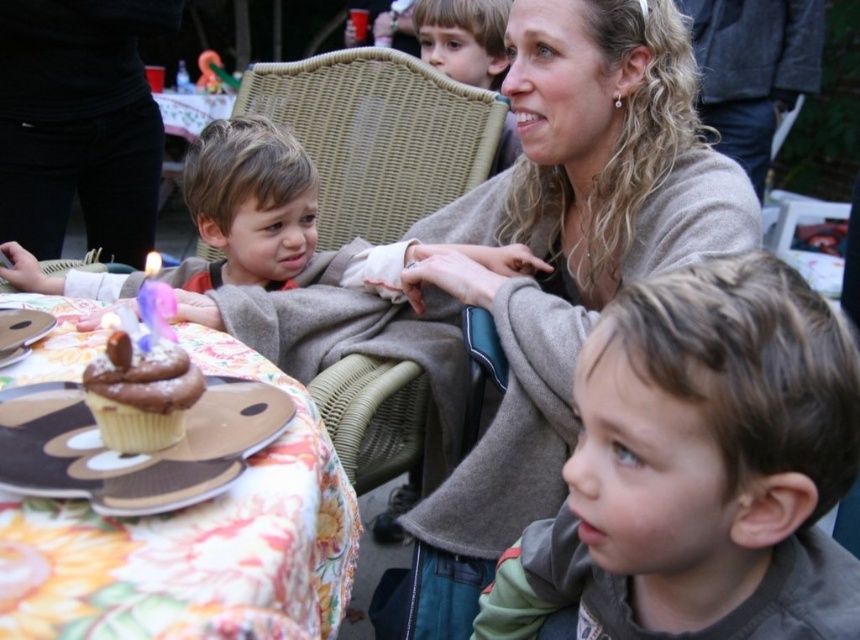
You are a guest at the birthday party and want to blow out the purple wax candle at center. To do so, you need to reach over the chocolate matte cupcake at lower left. Is the candle above or below the cupcake?

The chocolate matte cupcake at lower left is located below the purple wax candle at center, so the candle is above the cupcake. You can safely blow it out by reaching over.

You are a guest at this birthday celebration and notice the chocolate matte cupcake at lower left and the purple wax candle at center. Which object is shorter?

The chocolate matte cupcake at lower left is shorter than the purple wax candle at center.

You are a photographer trying to capture a closeup of the purple wax candle at center without the chocolate matte cupcake at lower left blocking the view. Can you position yourself so that the candle is fully visible? Explain your reasoning.

The chocolate matte cupcake at lower left is in front of the purple wax candle at center, so moving the camera to a higher angle or shifting position to the side would allow the candle to be seen without obstruction.